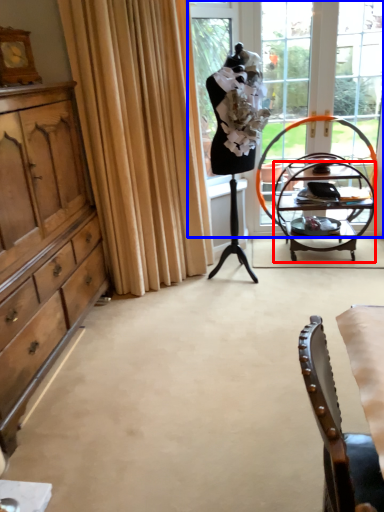
Question: Which point is closer to the camera, desk (highlighted by a red box) or window (highlighted by a blue box)?

Choices:
 (A) desk
 (B) window

Answer: (A)